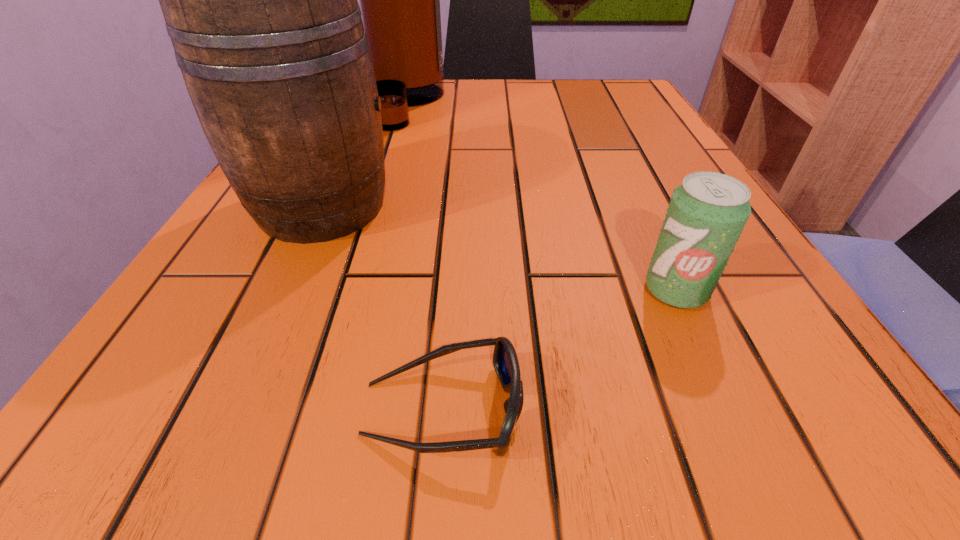
Locate an element on the screen. The height and width of the screenshot is (540, 960). blank area at the right edge is located at coordinates (797, 332).

Locate an element on the screen. vacant space at the far right corner of the desktop is located at coordinates (640, 119).

Find the location of a particular element. Image resolution: width=960 pixels, height=540 pixels. free region at the near right corner is located at coordinates (862, 454).

Image resolution: width=960 pixels, height=540 pixels. I want to click on free space that is in between the liquor and the soda, so coord(541,197).

Locate an element on the screen. free space between the second nearest object and the farthest object is located at coordinates (541, 197).

I want to click on free point between the sunglasses and the third tallest object, so click(559, 349).

I want to click on vacant region between the cider and the soda, so click(x=499, y=248).

The width and height of the screenshot is (960, 540). Find the location of `free space that is in between the sunglasses and the second tallest object`. free space that is in between the sunglasses and the second tallest object is located at coordinates (382, 307).

I want to click on blank region between the nearest object and the cider, so click(382, 307).

I want to click on vacant point located between the liquor and the shortest object, so click(x=424, y=256).